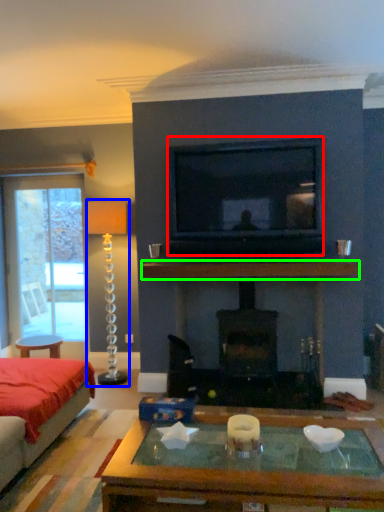
Question: Estimate the real-world distances between objects in this image. Which object is farther from television (highlighted by a red box), candle holder (highlighted by a blue box) or mantle (highlighted by a green box)?

Choices:
 (A) candle holder
 (B) mantle

Answer: (A)